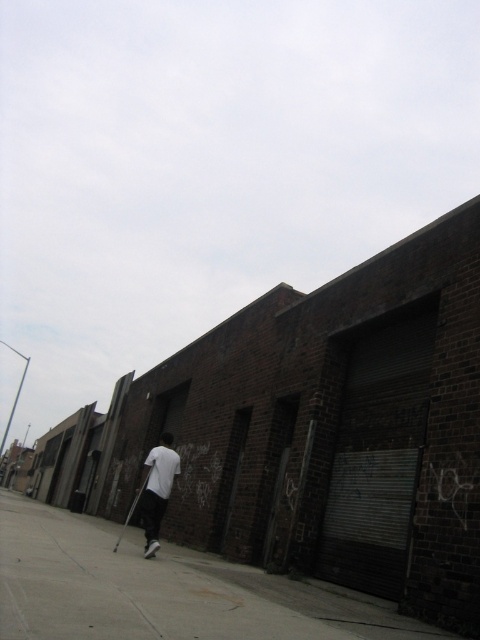
Who is positioned more to the right, gray concrete sidewalk at lower center or white matte shirt at center?

gray concrete sidewalk at lower center is more to the right.

Locate an element on the screen. Image resolution: width=480 pixels, height=640 pixels. gray concrete sidewalk at lower center is located at coordinates (158, 589).

Is point (69, 584) farther from viewer compared to point (155, 490)?

No.

Where is `gray concrete sidewalk at lower center`? This screenshot has width=480, height=640. gray concrete sidewalk at lower center is located at coordinates (158, 589).